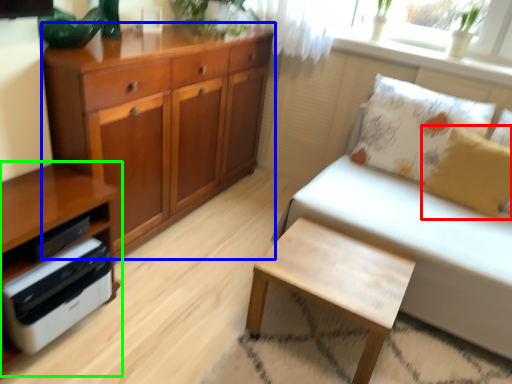
Question: Estimate the real-world distances between objects in this image. Which object is closer to pillow (highlighted by a red box), chest of drawers (highlighted by a blue box) or cabinetry (highlighted by a green box)?

Choices:
 (A) chest of drawers
 (B) cabinetry

Answer: (A)